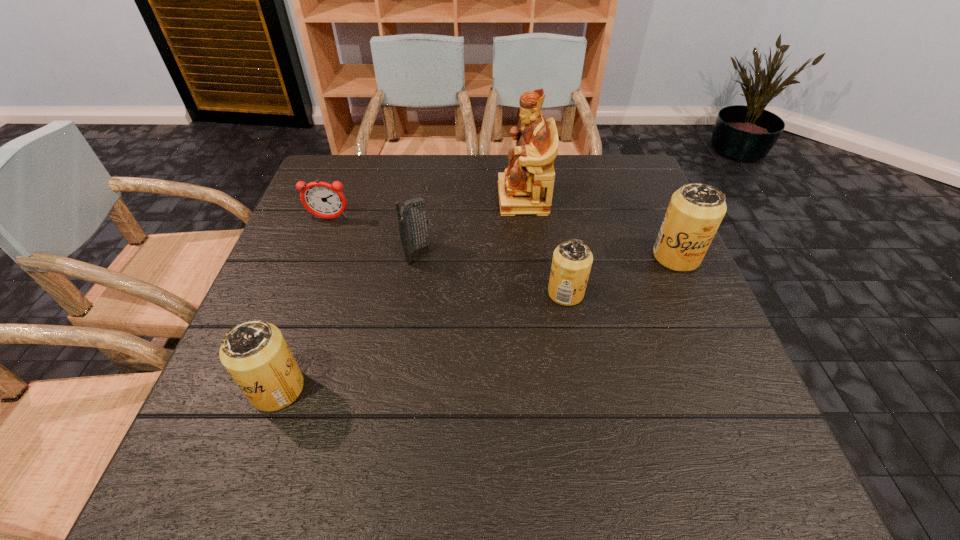
This screenshot has width=960, height=540. Find the location of `free space located 0.140m on the front of the second nearest beer can`. free space located 0.140m on the front of the second nearest beer can is located at coordinates (578, 362).

At what (x,y) coordinates should I click in order to perform the action: click on free point located 0.160m on the back of the rightmost object. Please return your answer as a coordinate pair (x, y). Looking at the image, I should click on (652, 202).

Locate an element on the screen. Image resolution: width=960 pixels, height=540 pixels. vacant space positioned on the front-facing side of the tallest object is located at coordinates (380, 198).

Identify the location of vacant space located 0.390m on the front-facing side of the tallest object. Image resolution: width=960 pixels, height=540 pixels. (358, 198).

Where is `blank space located 0.260m on the front-facing side of the tallest object`? The height and width of the screenshot is (540, 960). blank space located 0.260m on the front-facing side of the tallest object is located at coordinates (405, 198).

Where is `vacant area located 0.330m on the front-facing side of the alarm clock`? The height and width of the screenshot is (540, 960). vacant area located 0.330m on the front-facing side of the alarm clock is located at coordinates (290, 321).

Where is `free space located 0.090m on the keyboard of the cellular telephone`? This screenshot has height=540, width=960. free space located 0.090m on the keyboard of the cellular telephone is located at coordinates (467, 253).

Find the location of `object that is at the far edge`. object that is at the far edge is located at coordinates (526, 187).

Locate an element on the screen. The height and width of the screenshot is (540, 960). object positioned at the near edge is located at coordinates (255, 353).

The width and height of the screenshot is (960, 540). What are the coordinates of `beer can positioned at the left edge` in the screenshot? It's located at (255, 353).